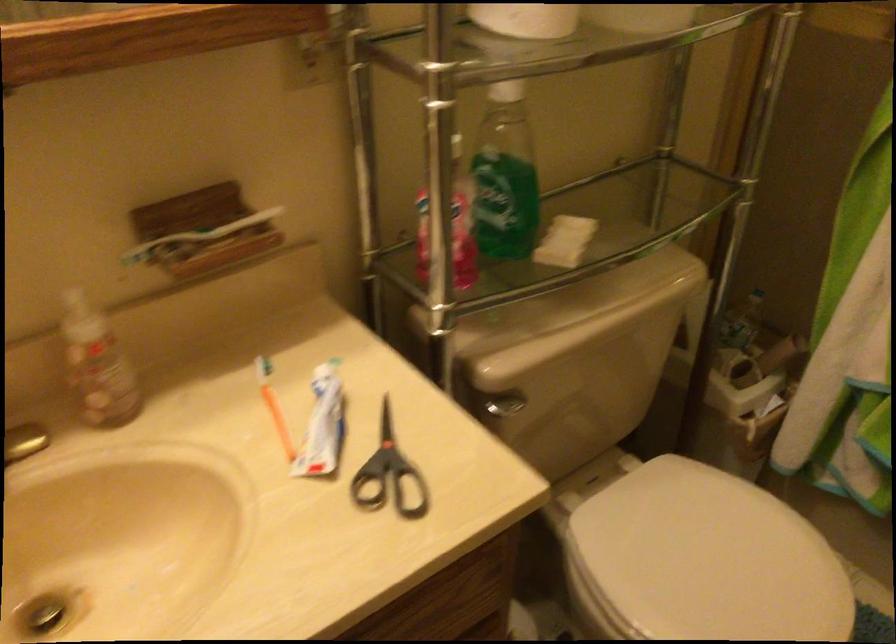
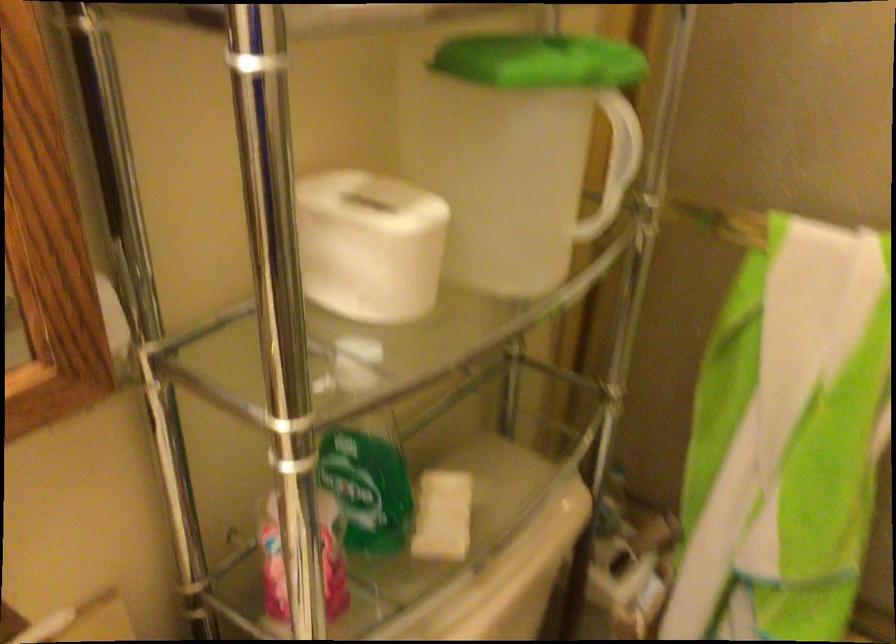
Question: What movement of the cameraman would produce the second image?

Choices:
 (A) Left
 (B) Right
 (C) Forward
 (D) Backward

Answer: (C)